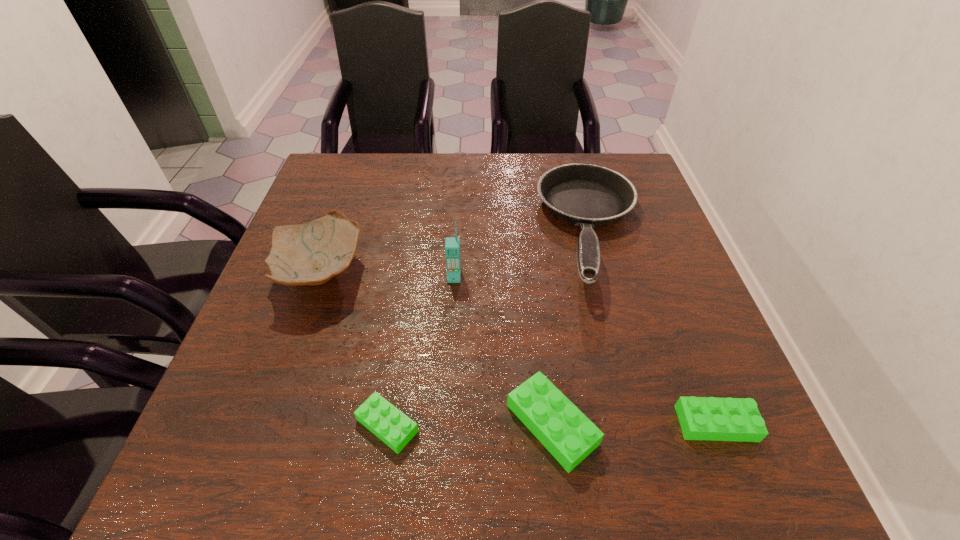
In order to click on frying pan located in the right edge section of the desktop in this screenshot , I will do `click(587, 195)`.

The height and width of the screenshot is (540, 960). Identify the location of object present at the far right corner. (587, 195).

Locate an element on the screen. This screenshot has height=540, width=960. object located in the near right corner section of the desktop is located at coordinates (701, 418).

Where is `vacant space at the far edge of the desktop`? vacant space at the far edge of the desktop is located at coordinates (460, 178).

Find the location of a particular element. blank space at the left edge is located at coordinates (289, 296).

The height and width of the screenshot is (540, 960). I want to click on vacant space at the right edge of the desktop, so click(x=655, y=310).

In the image, there is a desktop. At what (x,y) coordinates should I click in order to perform the action: click on vacant space at the far left corner. Please return your answer as a coordinate pair (x, y). This screenshot has width=960, height=540. Looking at the image, I should click on [x=340, y=181].

Where is `vacant space at the near left corner of the desktop`? The height and width of the screenshot is (540, 960). vacant space at the near left corner of the desktop is located at coordinates (300, 415).

The width and height of the screenshot is (960, 540). Find the location of `free space at the far right corner of the desktop`. free space at the far right corner of the desktop is located at coordinates (609, 166).

Where is `vacant area between the third shortest object and the leftmost object`? This screenshot has height=540, width=960. vacant area between the third shortest object and the leftmost object is located at coordinates (436, 348).